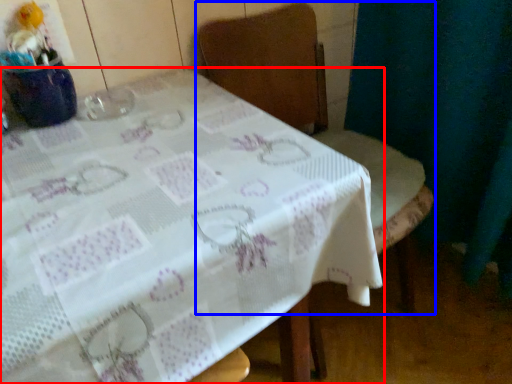
Question: Which of the following is the closest to the observer, table (highlighted by a red box) or chair (highlighted by a blue box)?

Choices:
 (A) table
 (B) chair

Answer: (A)